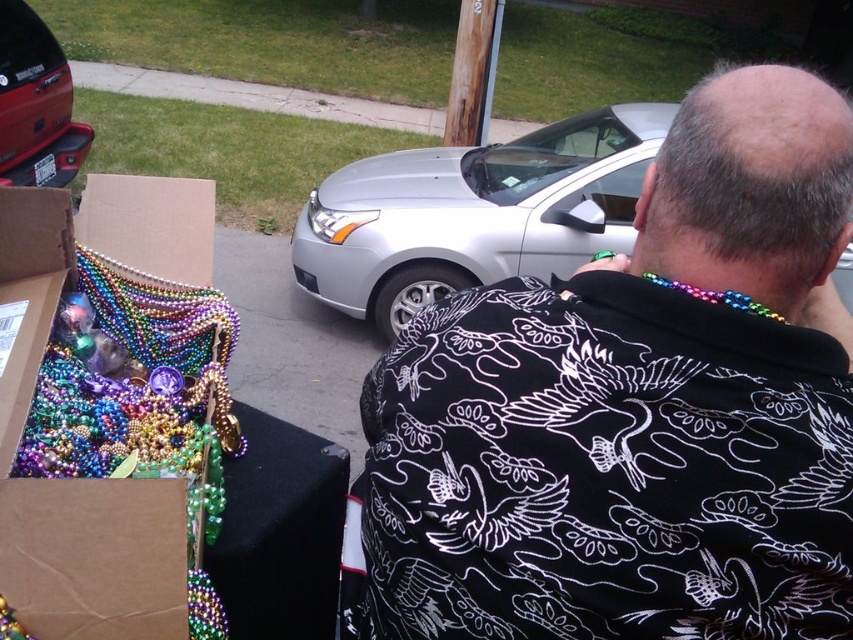
Question: Is silver metallic car at center smaller than matte red car at upper left?

Choices:
 (A) no
 (B) yes

Answer: (A)

Question: Which point is farther to the camera?

Choices:
 (A) (636, 308)
 (B) (605, 122)
 (C) (49, 92)

Answer: (C)

Question: Does black printed shirt at center appear on the left side of matte red car at upper left?

Choices:
 (A) no
 (B) yes

Answer: (A)

Question: Considering the real-world distances, which object is farthest from the black printed shirt at center?

Choices:
 (A) silver metallic car at center
 (B) matte red car at upper left

Answer: (B)

Question: Which point is closer to the camera taking this photo?

Choices:
 (A) (618, 186)
 (B) (654, 568)

Answer: (B)

Question: Does black printed shirt at center lie behind silver metallic car at center?

Choices:
 (A) yes
 (B) no

Answer: (B)